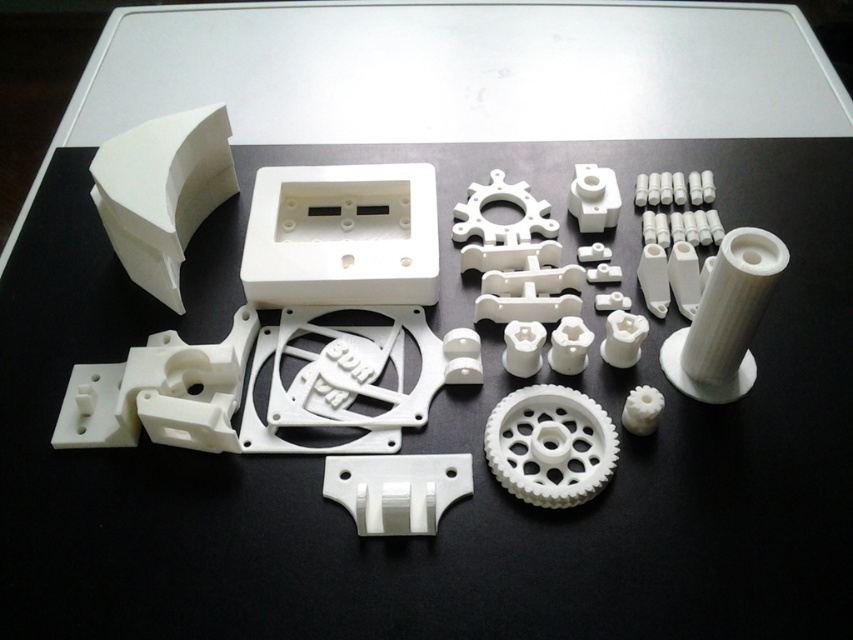
Where is the white plastic gear at center located in the image?

The white plastic gear at center is located at point (550,445) in the image.

You are assembling a model and need to align the white matte plastic gear at upper left and the white matte gear at center. Which gear should you place first to ensure proper alignment?

You should place the white matte plastic gear at upper left first because it is closer to the viewer and needs to be positioned before the white matte gear at center to ensure proper alignment.

You are assembling a model and need to place the white matte plastic gear at upper left and the white matte gear at center. According to the layout, which gear should be placed first if you follow a left to right assembly sequence?

The white matte plastic gear at upper left should be placed first because it is positioned on the left side of the white matte gear at center, following a left to right assembly sequence.